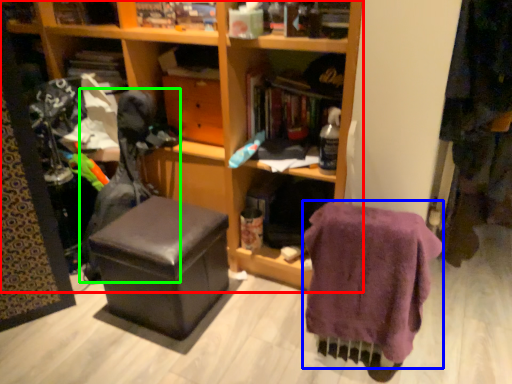
Question: Estimate the real-world distances between objects in this image. Which object is farther from furniture (highlighted by a red box), clothing (highlighted by a blue box) or swivel chair (highlighted by a green box)?

Choices:
 (A) clothing
 (B) swivel chair

Answer: (A)